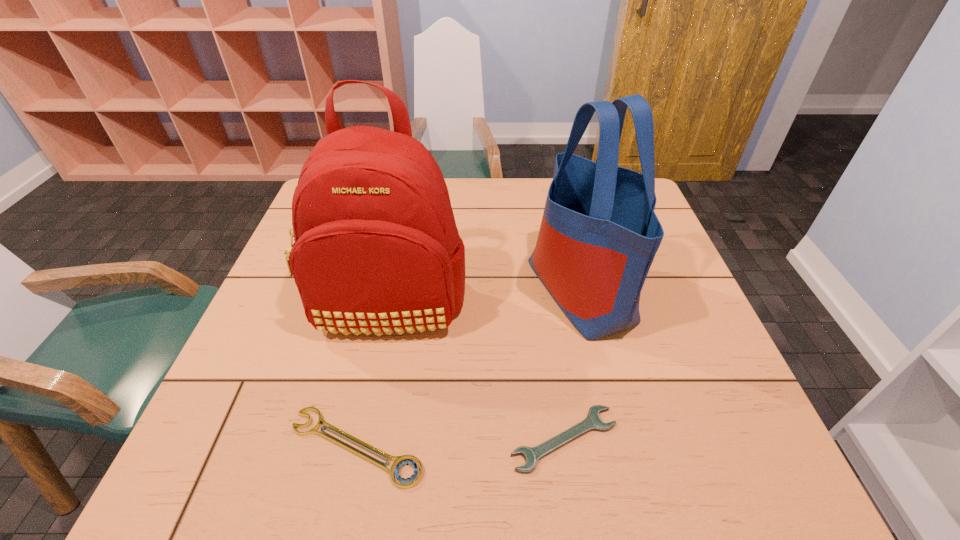
In the image, there is a desktop. Where is `blank space at the far edge`? The width and height of the screenshot is (960, 540). blank space at the far edge is located at coordinates (539, 205).

I want to click on vacant space at the near edge of the desktop, so 561,456.

Locate an element on the screen. Image resolution: width=960 pixels, height=540 pixels. free space at the left edge of the desktop is located at coordinates (264, 367).

Identify the location of vacant space at the right edge of the desktop. This screenshot has height=540, width=960. (703, 376).

Image resolution: width=960 pixels, height=540 pixels. What are the coordinates of `unoccupied position between the left wrench and the backpack` in the screenshot? It's located at (372, 376).

The height and width of the screenshot is (540, 960). I want to click on empty space between the left wrench and the handbag, so click(468, 368).

Where is `vacant area that lies between the handbag and the left wrench`? This screenshot has height=540, width=960. vacant area that lies between the handbag and the left wrench is located at coordinates (468, 368).

Where is `free spot between the backpack and the left wrench`? The image size is (960, 540). free spot between the backpack and the left wrench is located at coordinates (372, 376).

Where is `free space between the right wrench and the handbag`? The height and width of the screenshot is (540, 960). free space between the right wrench and the handbag is located at coordinates (572, 364).

Identify the location of unoccupied area between the handbag and the left wrench. The width and height of the screenshot is (960, 540). (468, 368).